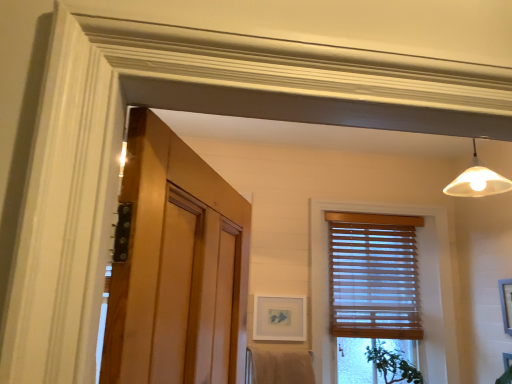
Locate an element on the screen. The image size is (512, 384). beige cotton bath towel at lower center is located at coordinates (281, 367).

What is the approximate height of beige cotton bath towel at lower center?

The height of beige cotton bath towel at lower center is 8.53 inches.

What is the approximate height of white matte picture frame at right, which is counted as the 1th picture frame, starting from the front?

white matte picture frame at right, which is counted as the 1th picture frame, starting from the front, is 12.72 inches in height.

Image resolution: width=512 pixels, height=384 pixels. Find the location of `green leafy plant at lower right`. green leafy plant at lower right is located at coordinates (392, 365).

Locate an element on the screen. The width and height of the screenshot is (512, 384). wooden blinds at center is located at coordinates (420, 287).

Where is `beige cotton bath towel at lower center`? This screenshot has height=384, width=512. beige cotton bath towel at lower center is located at coordinates (281, 367).

Is white matte picture frame at right, acting as the first picture frame starting from the right, spatially inside beige cotton bath towel at lower center, or outside of it?

white matte picture frame at right, acting as the first picture frame starting from the right, is not inside beige cotton bath towel at lower center, it's outside.

Relative to beige cotton bath towel at lower center, is white matte picture frame at right, which is the second picture frame in left-to-right order, in front or behind?

Visually, white matte picture frame at right, which is the second picture frame in left-to-right order, is located in front of beige cotton bath towel at lower center.

Looking at their sizes, would you say white matte picture frame at right, which is counted as the 1th picture frame, starting from the front, is wider or thinner than beige cotton bath towel at lower center?

Considering their sizes, white matte picture frame at right, which is counted as the 1th picture frame, starting from the front, looks slimmer than beige cotton bath towel at lower center.

You are a GUI agent. You are given a task and a screenshot of the screen. Output one action in this format:
    pyautogui.click(x=<x>, y=<y>)
    Task: Click on the picture frame that is the 2nd one above the beige cotton bath towel at lower center (from a real-world perspective)
    
    Given the screenshot: What is the action you would take?
    pyautogui.click(x=506, y=303)

Based on their positions, is matte white picture frame at center, which is the 2th picture frame in front-to-back order, located to the left or right of beige cotton bath towel at lower center?

Based on their positions, matte white picture frame at center, which is the 2th picture frame in front-to-back order, is located to the left of beige cotton bath towel at lower center.

Is matte white picture frame at center, acting as the second picture frame starting from the right, completely or partially outside of beige cotton bath towel at lower center?

Yes, matte white picture frame at center, acting as the second picture frame starting from the right, is outside of beige cotton bath towel at lower center.

From a real-world perspective, is matte white picture frame at center, acting as the second picture frame starting from the right, physically below beige cotton bath towel at lower center?

No, from a real-world perspective, matte white picture frame at center, acting as the second picture frame starting from the right, is not below beige cotton bath towel at lower center.

Which is in front, wooden blinds at center or wooden blinds at right?

wooden blinds at center is more forward.

Identify the location of window below the wooden blinds at right (from the image's perspective). The width and height of the screenshot is (512, 384). (420, 287).

Is point (426, 376) farther from viewer compared to point (369, 294)?

No.

From the picture: Is beige cotton bath towel at lower center beside green leafy plant at lower right?

They are not placed beside each other.

Considering the relative sizes of beige cotton bath towel at lower center and green leafy plant at lower right in the image provided, is beige cotton bath towel at lower center wider than green leafy plant at lower right?

In fact, beige cotton bath towel at lower center might be narrower than green leafy plant at lower right.

Is beige cotton bath towel at lower center oriented away from green leafy plant at lower right?

No, green leafy plant at lower right is not at the back of beige cotton bath towel at lower center.

How far apart are beige cotton bath towel at lower center and green leafy plant at lower right?

beige cotton bath towel at lower center is 26.12 inches away from green leafy plant at lower right.

Is white matte picture frame at right, acting as the first picture frame starting from the right, oriented away from matte white picture frame at center, which is the first picture frame from back to front?

No, matte white picture frame at center, which is the first picture frame from back to front, is not at the back of white matte picture frame at right, acting as the first picture frame starting from the right.

From a real-world perspective, which object stands above the other?

white matte picture frame at right, which is counted as the 1th picture frame, starting from the front.

Is white matte picture frame at right, which is the second picture frame in left-to-right order, not near matte white picture frame at center, which ranks as the 1th picture frame in left-to-right order?

That's right, there is a large distance between white matte picture frame at right, which is the second picture frame in left-to-right order, and matte white picture frame at center, which ranks as the 1th picture frame in left-to-right order.

Is white matte picture frame at right, which is counted as the 1th picture frame, starting from the front, outside of matte white picture frame at center, which ranks as the 1th picture frame in left-to-right order?

Indeed, white matte picture frame at right, which is counted as the 1th picture frame, starting from the front, is completely outside matte white picture frame at center, which ranks as the 1th picture frame in left-to-right order.

Locate an element on the screen. The width and height of the screenshot is (512, 384). bath towel below the wooden blinds at right (from the image's perspective) is located at coordinates (281, 367).

Between point (393, 303) and point (294, 382), which one is positioned behind?

The point (393, 303) is behind.

Would you say wooden blinds at right contains beige cotton bath towel at lower center?

No, beige cotton bath towel at lower center is located outside of wooden blinds at right.

In terms of width, does green leafy plant at lower right look wider or thinner when compared to wooden blinds at right?

green leafy plant at lower right is wider than wooden blinds at right.

The height and width of the screenshot is (384, 512). I want to click on window blind located on the left of green leafy plant at lower right, so click(373, 276).

Is point (415, 367) positioned behind point (341, 282)?

No.

Is green leafy plant at lower right in front of or behind wooden blinds at right in the image?

In the image, green leafy plant at lower right appears in front of wooden blinds at right.

This screenshot has width=512, height=384. What are the coordinates of `bath towel below the white matte picture frame at right, which is counted as the 1th picture frame, starting from the front (from the image's perspective)` in the screenshot? It's located at (281, 367).

In order to click on bath towel on the right of the matte white picture frame at center, which is the first picture frame from back to front in this screenshot , I will do `click(281, 367)`.

Considering their positions, is matte white picture frame at center, which ranks as the 1th picture frame in left-to-right order, positioned further to wooden blinds at center than white matte picture frame at right, which is the second picture frame in left-to-right order?

white matte picture frame at right, which is the second picture frame in left-to-right order, is further to wooden blinds at center.

Considering their positions, is wooden blinds at center positioned closer to white matte picture frame at right, which is counted as the 1th picture frame, starting from the front, than beige cotton bath towel at lower center?

Among the two, wooden blinds at center is located nearer to white matte picture frame at right, which is counted as the 1th picture frame, starting from the front.

When comparing their distances from wooden blinds at center, does wooden blinds at right or matte white picture frame at center, acting as the second picture frame starting from the right, seem closer?

wooden blinds at right is closer to wooden blinds at center.

From the picture: When comparing their distances from matte white picture frame at center, which is the first picture frame from back to front, does white matte picture frame at right, acting as the first picture frame starting from the right, or beige cotton bath towel at lower center seem further?

white matte picture frame at right, acting as the first picture frame starting from the right.

Considering their positions, is wooden blinds at right positioned closer to green leafy plant at lower right than wooden blinds at center?

wooden blinds at right is positioned closer to the anchor green leafy plant at lower right.

From the image, which object appears to be farther from white matte picture frame at right, which is the second picture frame in left-to-right order, matte white picture frame at center, acting as the second picture frame starting from the right, or green leafy plant at lower right?

matte white picture frame at center, acting as the second picture frame starting from the right, is positioned further to the anchor white matte picture frame at right, which is the second picture frame in left-to-right order.

Based on their spatial positions, is green leafy plant at lower right or wooden blinds at center further from beige cotton bath towel at lower center?

The object further to beige cotton bath towel at lower center is green leafy plant at lower right.

Based on their spatial positions, is wooden blinds at center or white matte picture frame at right, acting as the first picture frame starting from the right, further from matte white picture frame at center, which is the first picture frame from back to front?

white matte picture frame at right, acting as the first picture frame starting from the right, is further to matte white picture frame at center, which is the first picture frame from back to front.

At what (x,y) coordinates should I click in order to perform the action: click on bath towel situated between matte white picture frame at center, acting as the second picture frame starting from the right, and green leafy plant at lower right from left to right. Please return your answer as a coordinate pair (x, y). Looking at the image, I should click on (281, 367).

Where is `window blind situated between matte white picture frame at center, which is the first picture frame from back to front, and white matte picture frame at right, the 2th picture frame from the back, from left to right`? The image size is (512, 384). window blind situated between matte white picture frame at center, which is the first picture frame from back to front, and white matte picture frame at right, the 2th picture frame from the back, from left to right is located at coordinates (373, 276).

Find the location of `plant between matte white picture frame at center, which is the 2th picture frame in front-to-back order, and white matte picture frame at right, which is the second picture frame in left-to-right order`. plant between matte white picture frame at center, which is the 2th picture frame in front-to-back order, and white matte picture frame at right, which is the second picture frame in left-to-right order is located at coordinates (392, 365).

Locate an element on the screen. Image resolution: width=512 pixels, height=384 pixels. window between matte white picture frame at center, acting as the second picture frame starting from the right, and white matte picture frame at right, the 2th picture frame from the back, from left to right is located at coordinates coord(420,287).